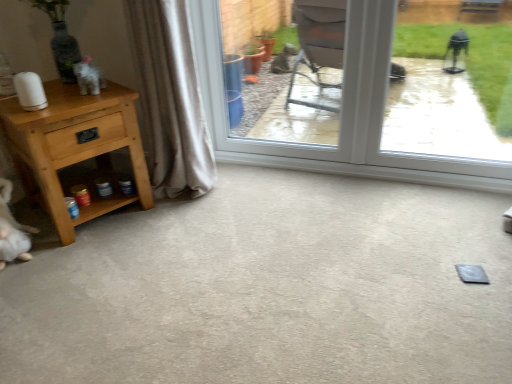
This screenshot has height=384, width=512. I want to click on vacant space to the right of light brown wood nightstand at left, so click(180, 221).